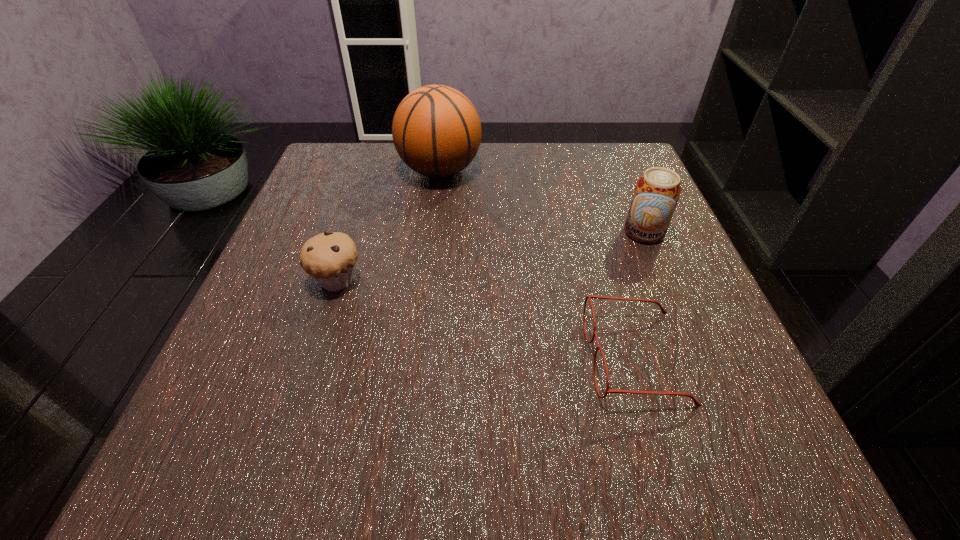
What are the coordinates of `vacant space situated on the back of the leftmost object` in the screenshot? It's located at (362, 202).

In order to click on vacant point located 0.290m on the face of the shortest object in this screenshot , I will do `click(398, 358)`.

The image size is (960, 540). I want to click on vacant space located 0.240m on the face of the shortest object, so click(431, 358).

This screenshot has height=540, width=960. Find the location of `blank space located 0.150m on the face of the shortest object`. blank space located 0.150m on the face of the shortest object is located at coordinates (491, 358).

Find the location of `object present at the far edge`. object present at the far edge is located at coordinates (436, 130).

Where is `object located at the left edge`? Image resolution: width=960 pixels, height=540 pixels. object located at the left edge is located at coordinates (329, 258).

Where is `beer can present at the right edge`? This screenshot has width=960, height=540. beer can present at the right edge is located at coordinates (657, 191).

Find the location of a particular element. This screenshot has width=960, height=540. spectacles located at the right edge is located at coordinates (697, 404).

The width and height of the screenshot is (960, 540). What are the coordinates of `vacant space at the far edge of the desktop` in the screenshot? It's located at (471, 186).

Locate an element on the screen. This screenshot has width=960, height=540. free space at the near edge of the desktop is located at coordinates (432, 435).